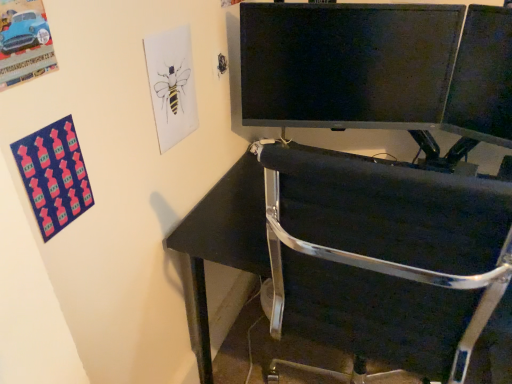
Question: From the image's perspective, relative to matte black monitor at upper right, is black glossy monitor at upper center above or below?

Choices:
 (A) below
 (B) above

Answer: (B)

Question: Do you think black glossy monitor at upper center is within matte black monitor at upper right, or outside of it?

Choices:
 (A) outside
 (B) inside

Answer: (A)

Question: Which of these objects is positioned closest to the matte black monitor at upper right?

Choices:
 (A) black metal chair at lower right
 (B) black glossy monitor at upper center

Answer: (B)

Question: Which object is positioned closest to the black metal chair at lower right?

Choices:
 (A) matte black monitor at upper right
 (B) black glossy monitor at upper center

Answer: (B)